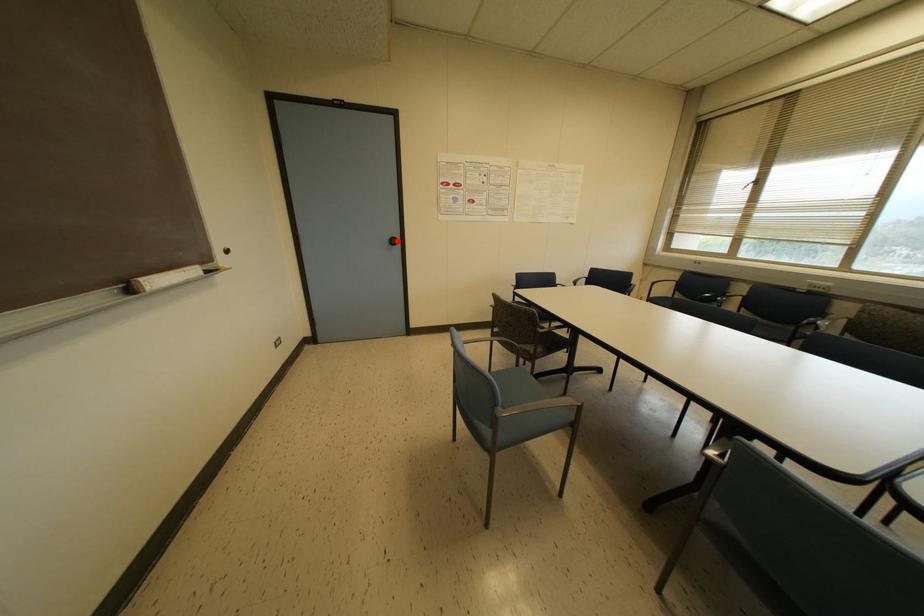
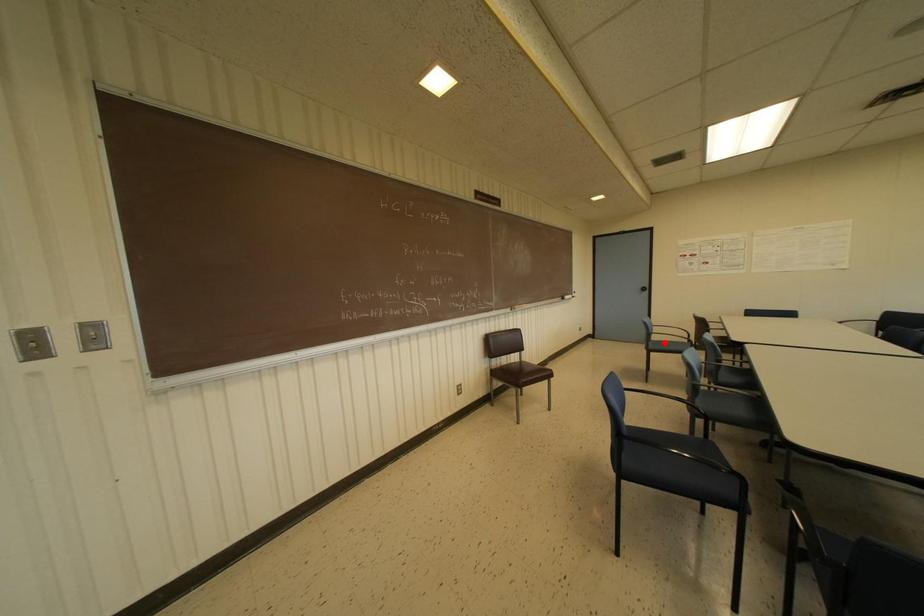
I am providing you with two images of the same scene from different viewpoints. A red point is marked on the first image and another point is marked on the second image. Do the highlighted points in image1 and image2 indicate the same real-world spot?

No